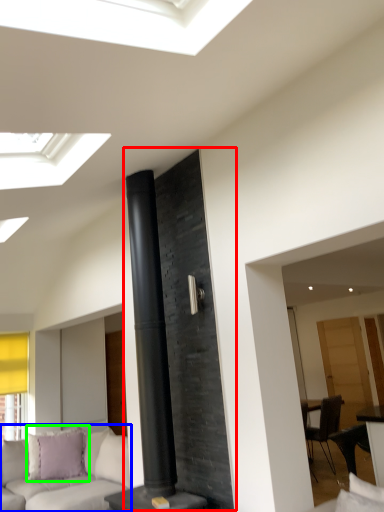
Question: Which object is the closest to the fireplace (highlighted by a red box)? Choose among these: studio couch (highlighted by a blue box) or pillow (highlighted by a green box).

Choices:
 (A) studio couch
 (B) pillow

Answer: (A)